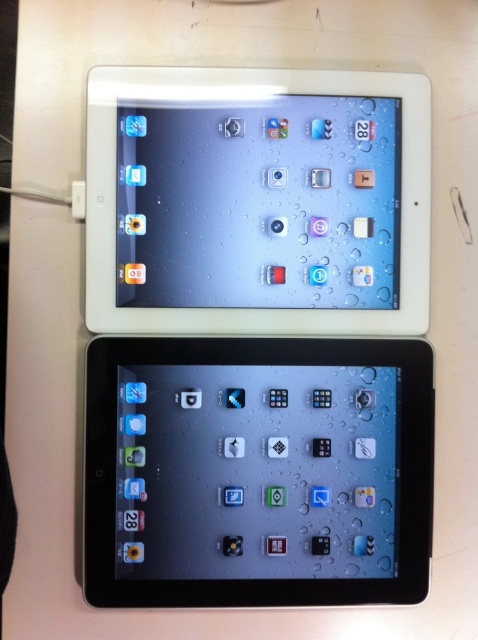
Based on the photo, you are organizing a tech showcase and need to arrange the black plastic tablet at center and the white glossy tablet at upper center on a display stand. According to the image, which tablet should be placed lower on the stand to match the original arrangement?

The black plastic tablet at center should be placed lower on the stand because it is located below the white glossy tablet at upper center in the original image.

You are setting up a display for an electronics store and need to arrange the black plastic tablet at center and the white glossy tablet at upper center based on their sizes. Which tablet should be placed at the bottom of the display to ensure stability?

The black plastic tablet at center is much taller than the white glossy tablet at upper center, so placing the taller black plastic tablet at center at the bottom will provide a stable base for the display.

Looking at this image, you are taking a photo of two points on a desk. The first point is at coordinate point (197, 378) and the second is at point (239, 144). Which point will appear closer to the camera in the photo?

Point (197, 378) is further to the camera than point (239, 144), so the second point will appear closer to the camera in the photo.